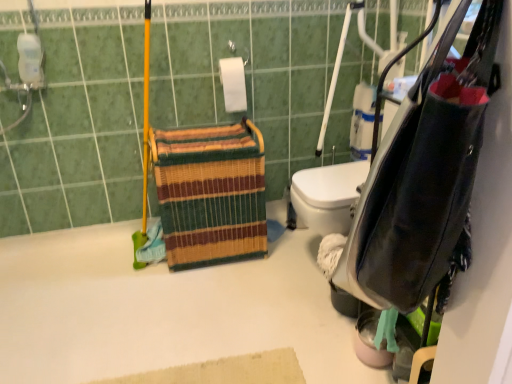
Where is `free space above white matte bath at upper left (from a real-world perspective)`? free space above white matte bath at upper left (from a real-world perspective) is located at coordinates (186, 311).